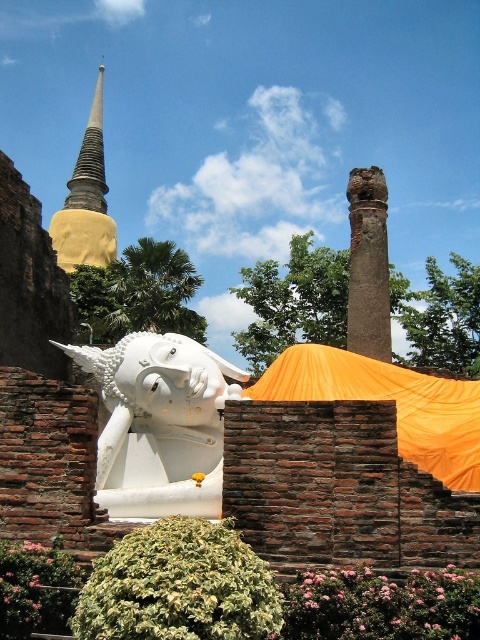
Can you confirm if white glossy statue at center is positioned to the right of smooth gold spire at upper left?

Correct, you'll find white glossy statue at center to the right of smooth gold spire at upper left.

Is point (162, 502) more distant than point (72, 244)?

No.

This screenshot has width=480, height=640. I want to click on white glossy statue at center, so point(158,424).

Who is taller, orange fabric canopy at center or smooth gold spire at upper left?

Standing taller between the two is smooth gold spire at upper left.

Does orange fabric canopy at center appear on the left side of smooth gold spire at upper left?

In fact, orange fabric canopy at center is to the right of smooth gold spire at upper left.

Between point (455, 452) and point (63, 250), which one is positioned behind?

The point (63, 250) is more distant.

The height and width of the screenshot is (640, 480). In order to click on orange fabric canopy at center in this screenshot , I will do `click(388, 400)`.

Which is more to the right, white glossy statue at center or orange fabric canopy at center?

Positioned to the right is orange fabric canopy at center.

Does white glossy statue at center have a larger size compared to orange fabric canopy at center?

No, white glossy statue at center is not bigger than orange fabric canopy at center.

Which is in front, point (104, 355) or point (466, 468)?

Point (466, 468)

Where is `white glossy statue at center`? This screenshot has width=480, height=640. white glossy statue at center is located at coordinates (158, 424).